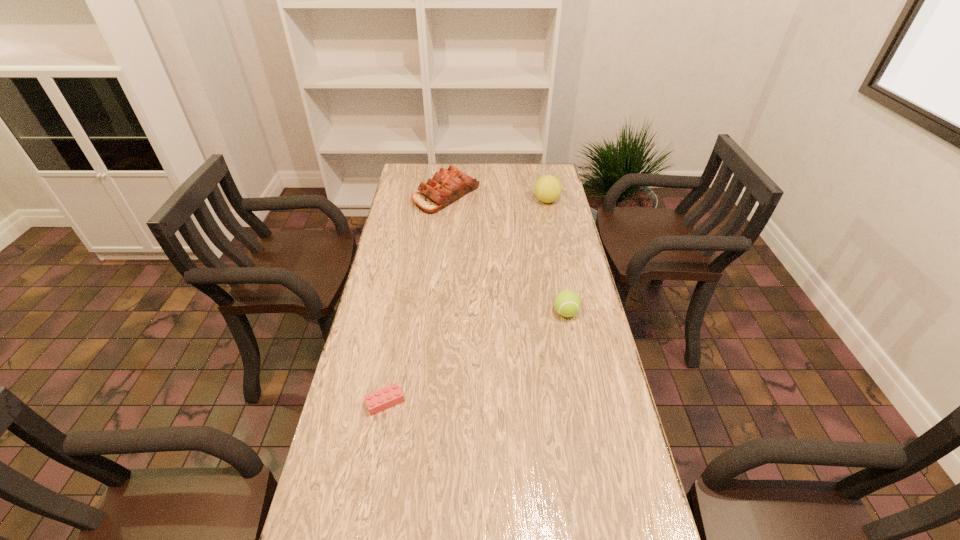
At what (x,y) coordinates should I click in order to perform the action: click on the taller tennis ball. Please return your answer as a coordinate pair (x, y). The image size is (960, 540). Looking at the image, I should click on (548, 188).

I want to click on bread, so click(x=447, y=186).

This screenshot has width=960, height=540. I want to click on the third tallest object, so click(567, 303).

I want to click on the second nearest object, so click(x=567, y=303).

At what (x,y) coordinates should I click in order to perform the action: click on Lego. Please return your answer as a coordinate pair (x, y). Looking at the image, I should click on (387, 397).

Find the location of a particular element. The image size is (960, 540). the nearest object is located at coordinates (387, 397).

You are a GUI agent. You are given a task and a screenshot of the screen. Output one action in this format:
    pyautogui.click(x=<x>, y=<y>)
    Task: Click on the free space located on the left of the farther tennis ball
    The image size is (960, 540).
    Given the screenshot: What is the action you would take?
    pyautogui.click(x=445, y=201)

The image size is (960, 540). What are the coordinates of `free point located on the right of the bread` in the screenshot? It's located at (532, 195).

Find the location of `free point located 0.310m on the left of the shorter tennis ball`. free point located 0.310m on the left of the shorter tennis ball is located at coordinates (456, 313).

At what (x,y) coordinates should I click in order to perform the action: click on vacant space located 0.080m on the right of the nearest object. Please return your answer as a coordinate pair (x, y). Looking at the image, I should click on (435, 402).